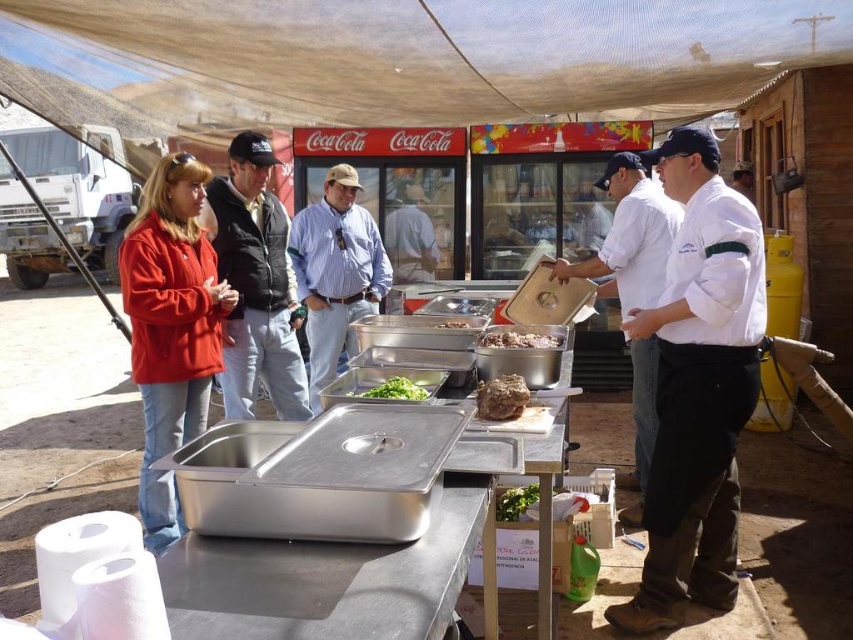
Between white matte chef coat at center and brown matte meat at center, which one has less height?

Standing shorter between the two is brown matte meat at center.

How far apart are white matte chef coat at center and brown matte meat at center?

white matte chef coat at center and brown matte meat at center are 24.54 inches apart from each other.

Between point (666, 468) and point (480, 346), which one is positioned behind?

The point (480, 346) is behind.

The height and width of the screenshot is (640, 853). I want to click on white matte chef coat at center, so click(698, 388).

Who is lower down, brushed metal food truck at left or brown matte meat at center?

Positioned lower is brown matte meat at center.

Identify the location of brushed metal food truck at left. This screenshot has width=853, height=640. (79, 186).

I want to click on brushed metal food truck at left, so click(79, 186).

Is brown matte meat at center shorter than green leafy vegetables at center?

No, brown matte meat at center is not shorter than green leafy vegetables at center.

Is the position of brown matte meat at center more distant than that of green leafy vegetables at center?

Yes, it is.

Image resolution: width=853 pixels, height=640 pixels. What do you see at coordinates (519, 339) in the screenshot?
I see `brown matte meat at center` at bounding box center [519, 339].

Where is `brown matte meat at center`? brown matte meat at center is located at coordinates (519, 339).